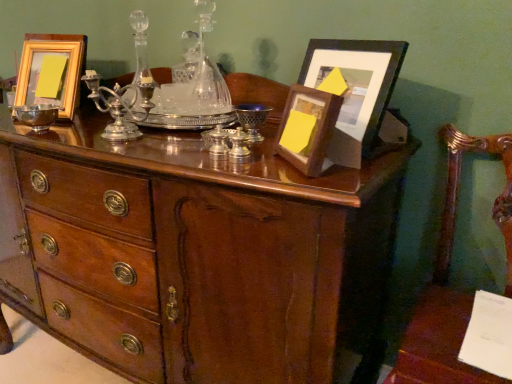
At what (x,y) coordinates should I click in order to perform the action: click on vacant space in front of gold wooden picture frame at upper left, the 3th picture frame in the right-to-left sequence. Please return your answer as a coordinate pair (x, y). Looking at the image, I should click on (41, 124).